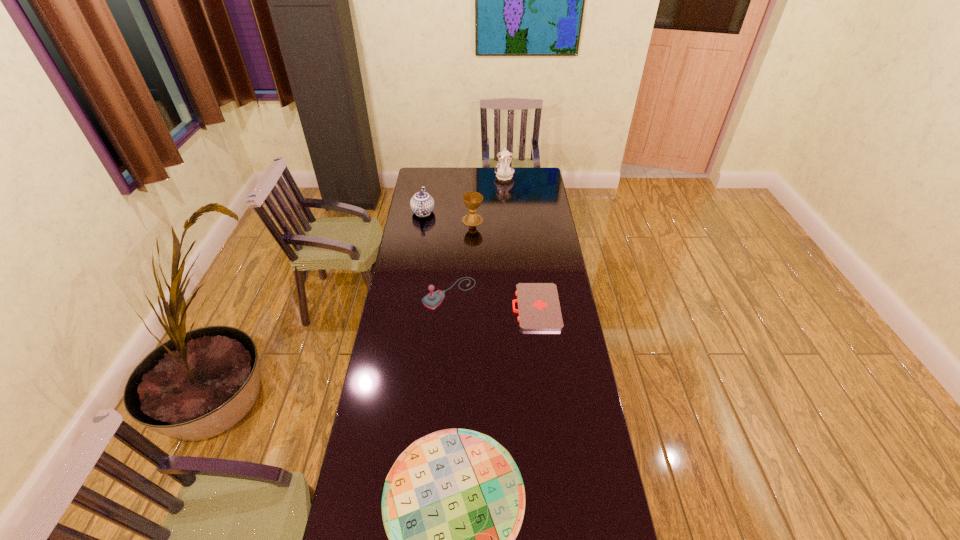
Where is `vacant space located 0.290m at the spout of the nearer chinaware`? The height and width of the screenshot is (540, 960). vacant space located 0.290m at the spout of the nearer chinaware is located at coordinates (429, 175).

This screenshot has width=960, height=540. I want to click on vacant region located 0.170m at the spout of the nearer chinaware, so click(427, 185).

I want to click on free space located on the right of the joystick, so click(x=553, y=293).

Identify the location of blank space located on handle side the first-aid kit. (432, 307).

At what (x,y) coordinates should I click in order to perform the action: click on blank area located on handle side the first-aid kit. Please return your answer as a coordinate pair (x, y). Looking at the image, I should click on (490, 307).

Locate an element on the screen. This screenshot has width=960, height=540. vacant area located 0.330m on handle side the first-aid kit is located at coordinates (437, 307).

The height and width of the screenshot is (540, 960). I want to click on object that is at the far edge, so click(x=504, y=170).

You are a GUI agent. You are given a task and a screenshot of the screen. Output one action in this format:
    pyautogui.click(x=<x>, y=<y>)
    Task: Click on the chinaware situated at the left edge
    This screenshot has width=960, height=540.
    Given the screenshot: What is the action you would take?
    point(422,204)

Where is `joystick present at the left edge`? The width and height of the screenshot is (960, 540). joystick present at the left edge is located at coordinates (433, 299).

Identify the location of object located in the right edge section of the desktop. The height and width of the screenshot is (540, 960). (539, 309).